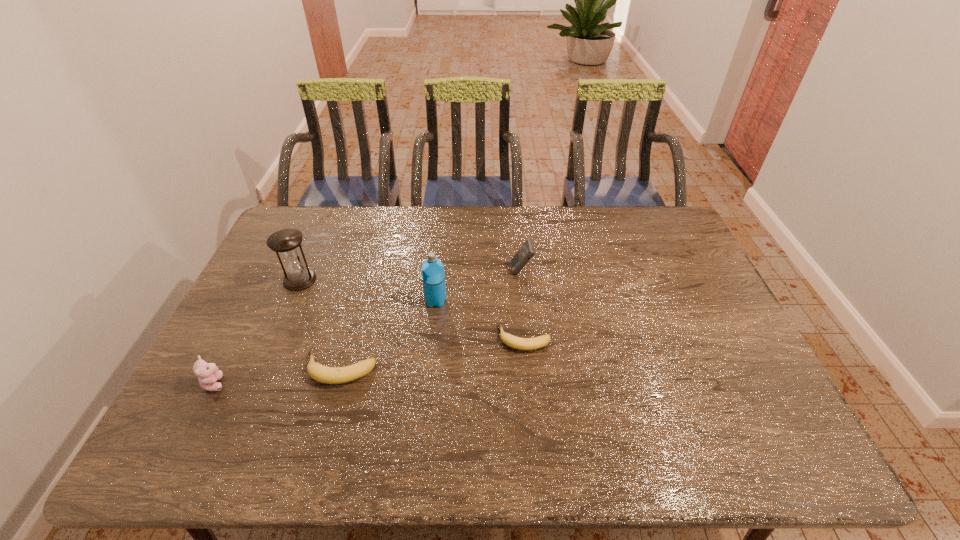
At what (x,y) coordinates should I click in order to perform the action: click on the third object from left to right. Please return your answer as a coordinate pair (x, y). Looking at the image, I should click on (329, 375).

Image resolution: width=960 pixels, height=540 pixels. Find the location of `the second shortest object`. the second shortest object is located at coordinates (329, 375).

You are a GUI agent. You are given a task and a screenshot of the screen. Output one action in this format:
    pyautogui.click(x=<x>, y=<y>)
    Task: Click on the shortest object
    The width and height of the screenshot is (960, 540).
    Given the screenshot: What is the action you would take?
    pyautogui.click(x=512, y=341)

Identify the location of the shorter banana. (512, 341).

You are a GUI agent. You are given a task and a screenshot of the screen. Output one action in this format:
    pyautogui.click(x=<x>, y=<y>)
    Task: Click on the thermos bottle
    
    Given the screenshot: What is the action you would take?
    pyautogui.click(x=433, y=276)

Find the location of a particular element. the third object from right to left is located at coordinates (433, 276).

This screenshot has height=540, width=960. I want to click on hourglass, so click(286, 243).

Locate an element on the screen. This screenshot has width=960, height=540. teddy bear is located at coordinates (208, 373).

Where is `the third shortest object`? The height and width of the screenshot is (540, 960). the third shortest object is located at coordinates (208, 373).

Where is `calculator`? The height and width of the screenshot is (540, 960). calculator is located at coordinates (526, 252).